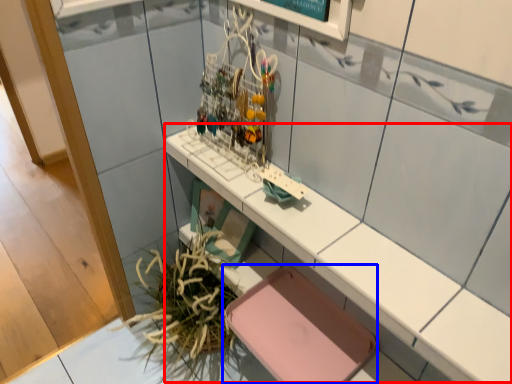
Question: Among these objects, which one is nearest to the camera, counter (highlighted by a red box) or chair (highlighted by a blue box)?

Choices:
 (A) counter
 (B) chair

Answer: (A)